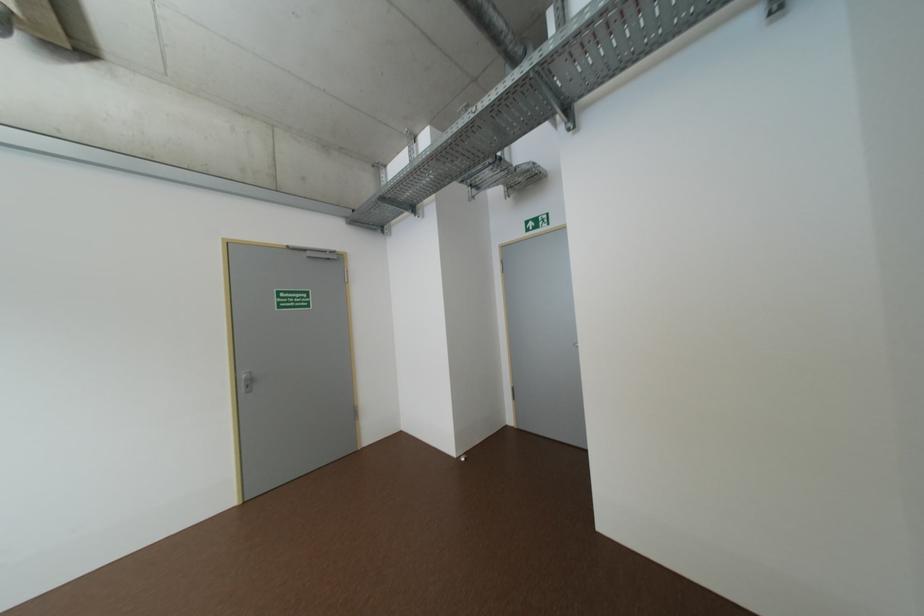
Locate an element on the screen. The width and height of the screenshot is (924, 616). metal door handle is located at coordinates (246, 381).